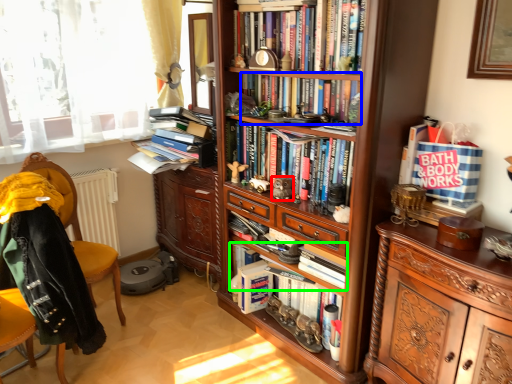
Question: Which is nearer to the toy (highlighted by a red box)? book (highlighted by a blue box) or book (highlighted by a green box).

Choices:
 (A) book
 (B) book

Answer: (B)